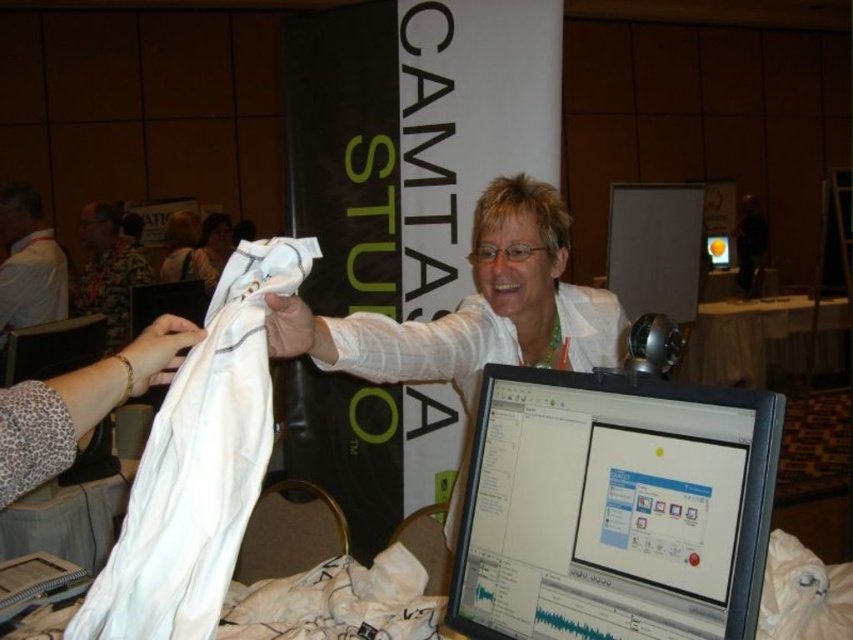
Where is `white matte shirt at center`? This screenshot has width=853, height=640. white matte shirt at center is located at coordinates (474, 314).

Is white matte shirt at center to the left of camouflage fabric shirt at upper left from the viewer's perspective?

In fact, white matte shirt at center is to the right of camouflage fabric shirt at upper left.

The image size is (853, 640). In order to click on white matte shirt at center in this screenshot , I will do `click(474, 314)`.

Where is `white matte shirt at center`? This screenshot has width=853, height=640. white matte shirt at center is located at coordinates (474, 314).

Is white fabric at center positioned in front of white fabric at left?

Yes.

Can you confirm if white fabric at center is positioned below white fabric at left?

Yes.

The width and height of the screenshot is (853, 640). What do you see at coordinates (80, 403) in the screenshot?
I see `white fabric at center` at bounding box center [80, 403].

Locate an element on the screen. This screenshot has height=640, width=853. white fabric at center is located at coordinates (80, 403).

From the picture: Is white fabric at upper center above matte black monitor at center?

No, white fabric at upper center is not above matte black monitor at center.

Which is below, white fabric at upper center or matte black monitor at center?

white fabric at upper center

Which is in front, point (209, 280) or point (723, 243)?

Point (209, 280)

At what (x,y) coordinates should I click in order to perform the action: click on white fabric at upper center. Please return your answer as a coordinate pair (x, y). The height and width of the screenshot is (640, 853). Looking at the image, I should click on (186, 252).